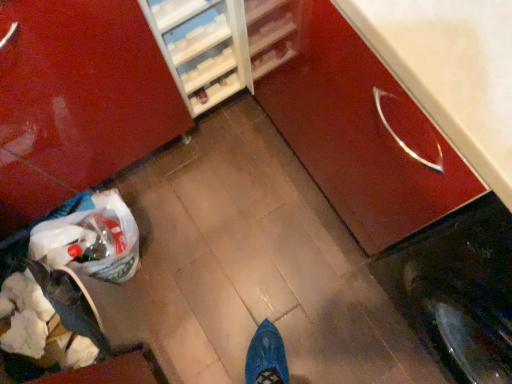
Question: Is glossy wood cabinet at center right, the second cabinetry positioned from the left, at the right side of white paper bag at lower left?

Choices:
 (A) no
 (B) yes

Answer: (B)

Question: Is white paper bag at lower left at the back of glossy wood cabinet at center right, arranged as the first cabinetry when viewed from the right?

Choices:
 (A) yes
 (B) no

Answer: (B)

Question: From the image's perspective, is glossy wood cabinet at center right, the second cabinetry positioned from the left, beneath white paper bag at lower left?

Choices:
 (A) no
 (B) yes

Answer: (A)

Question: Does glossy wood cabinet at center right, the second cabinetry positioned from the left, have a lesser height compared to white paper bag at lower left?

Choices:
 (A) no
 (B) yes

Answer: (A)

Question: Is point (87, 319) positioned closer to the camera than point (27, 24)?

Choices:
 (A) closer
 (B) farther

Answer: (B)

Question: Looking at their shapes, would you say white paper bag at lower left is wider or thinner than glossy wood cabinet at lower right, arranged as the first cabinetry when viewed from the left?

Choices:
 (A) wide
 (B) thin

Answer: (B)

Question: From a real-world perspective, is white paper bag at lower left physically located above or below glossy wood cabinet at lower right, the 2th cabinetry when ordered from right to left?

Choices:
 (A) below
 (B) above

Answer: (A)

Question: Looking at the image, does white paper bag at lower left seem bigger or smaller compared to glossy wood cabinet at lower right, the 2th cabinetry when ordered from right to left?

Choices:
 (A) small
 (B) big

Answer: (A)

Question: Is white paper bag at lower left wider or thinner than glossy wood cabinet at center right, the second cabinetry positioned from the left?

Choices:
 (A) wide
 (B) thin

Answer: (B)

Question: In terms of height, does white paper bag at lower left look taller or shorter compared to glossy wood cabinet at center right, the second cabinetry positioned from the left?

Choices:
 (A) short
 (B) tall

Answer: (A)

Question: Considering the relative positions of white paper bag at lower left and glossy wood cabinet at center right, the second cabinetry positioned from the left, in the image provided, is white paper bag at lower left to the left or to the right of glossy wood cabinet at center right, the second cabinetry positioned from the left,?

Choices:
 (A) left
 (B) right

Answer: (A)

Question: From the image's perspective, is white paper bag at lower left located above or below glossy wood cabinet at center right, arranged as the first cabinetry when viewed from the right?

Choices:
 (A) below
 (B) above

Answer: (A)

Question: Relative to white paper bag at lower left, is glossy wood cabinet at lower right, arranged as the first cabinetry when viewed from the left, in front or behind?

Choices:
 (A) behind
 (B) front

Answer: (B)

Question: From a real-world perspective, relative to white paper bag at lower left, is glossy wood cabinet at lower right, the 2th cabinetry when ordered from right to left, vertically above or below?

Choices:
 (A) below
 (B) above

Answer: (B)